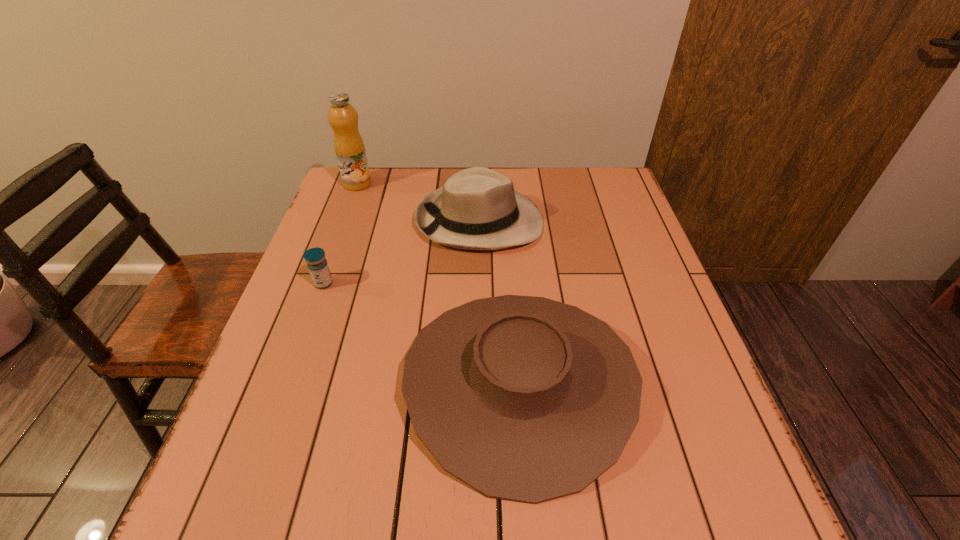
Where is `vacant space that's between the third tallest object and the fruit juice`? Image resolution: width=960 pixels, height=540 pixels. vacant space that's between the third tallest object and the fruit juice is located at coordinates (438, 284).

This screenshot has height=540, width=960. Find the location of `free space between the second shortest object and the fruit juice`. free space between the second shortest object and the fruit juice is located at coordinates (438, 284).

The image size is (960, 540). Find the location of `object that is the third closest to the third farthest object`. object that is the third closest to the third farthest object is located at coordinates (349, 147).

Select which object is the second closest to the tallest object. Please provide its 2D coordinates. Your answer should be formatted as a tuple, i.e. [(x, y)], where the tuple contains the x and y coordinates of a point satisfying the conditions above.

[(317, 264)]

This screenshot has height=540, width=960. What are the coordinates of `vacant position in the image that satisfies the following two spatial constraints: 1. on the back side of the second shortest object; 2. on the front-facing side of the fedora` in the screenshot? It's located at (507, 221).

The height and width of the screenshot is (540, 960). What are the coordinates of `free space that satisfies the following two spatial constraints: 1. on the front label of the tallest object; 2. on the right side of the shortest object` in the screenshot? It's located at (321, 284).

Where is `vacant position in the image that satisfies the following two spatial constraints: 1. on the front label of the second shortest object; 2. on the right side of the tallest object`? vacant position in the image that satisfies the following two spatial constraints: 1. on the front label of the second shortest object; 2. on the right side of the tallest object is located at coordinates click(x=284, y=384).

Identify the location of free space that satisfies the following two spatial constraints: 1. on the front-facing side of the third tallest object; 2. on the left side of the fedora. click(x=480, y=384).

Identify the location of vacant space that satisfies the following two spatial constraints: 1. on the front label of the tallest object; 2. on the back side of the third farthest object. The image size is (960, 540). (321, 284).

I want to click on vacant space that satisfies the following two spatial constraints: 1. on the front-facing side of the fedora; 2. on the right side of the nearest object, so click(480, 384).